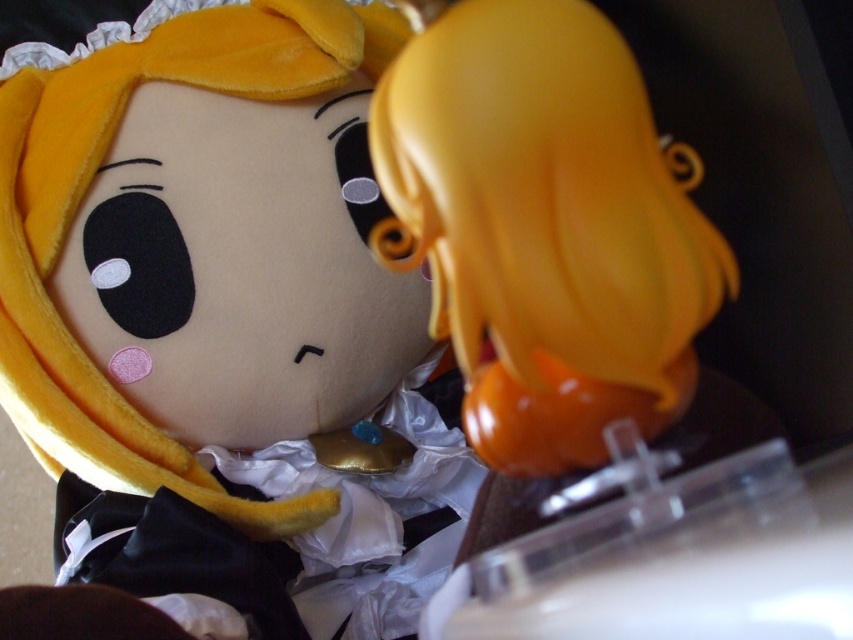
Measure the distance between velvet yellow plush toy at upper center and camera.

velvet yellow plush toy at upper center is 13.43 inches away from camera.

Can you confirm if velvet yellow plush toy at upper center is smaller than matte orange figurine at center?

No, velvet yellow plush toy at upper center is not smaller than matte orange figurine at center.

Which is in front, point (239, 36) or point (479, 272)?

Positioned in front is point (479, 272).

Where is `velvet yellow plush toy at upper center`? velvet yellow plush toy at upper center is located at coordinates (225, 324).